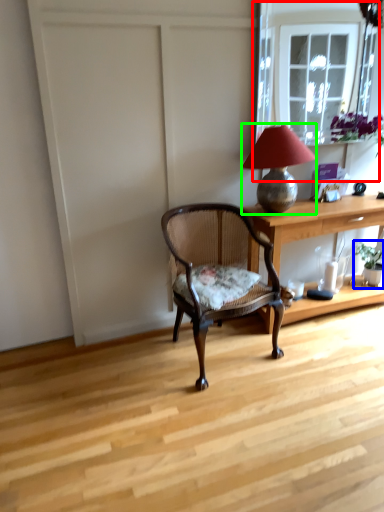
Question: Which object is positioned farthest from window frame (highlighted by a red box)? Select from houseplant (highlighted by a blue box) and lamp (highlighted by a green box).

Choices:
 (A) houseplant
 (B) lamp

Answer: (B)